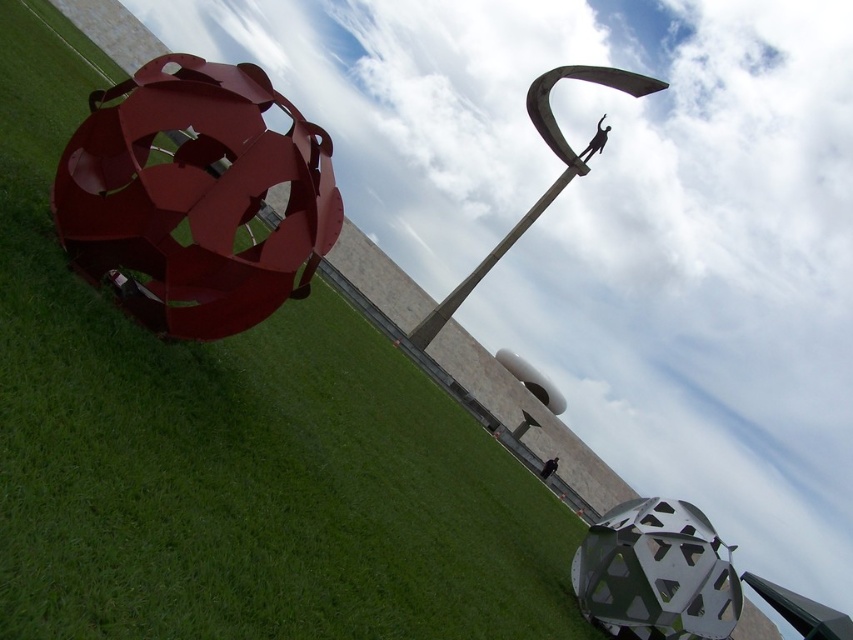
From the picture: Who is lower down, metallic sphere at center or polished metal sculpture at upper center?

metallic sphere at center is lower down.

Is point (96, 600) closer to viewer compared to point (642, 84)?

That is True.

Locate an element on the screen. metallic sphere at center is located at coordinates (233, 451).

Who is more distant from viewer, (286, 504) or (224, 307)?

The point (224, 307) is more distant.

Does metallic sphere at center come in front of rusty metal sphere at left?

Yes, metallic sphere at center is in front of rusty metal sphere at left.

The width and height of the screenshot is (853, 640). Find the location of `metallic sphere at center`. metallic sphere at center is located at coordinates (233, 451).

Who is shorter, rusty metal sphere at left or polished metal sculpture at upper center?

rusty metal sphere at left is shorter.

Describe the element at coordinates (195, 196) in the screenshot. I see `rusty metal sphere at left` at that location.

In order to click on rusty metal sphere at left in this screenshot , I will do `click(195, 196)`.